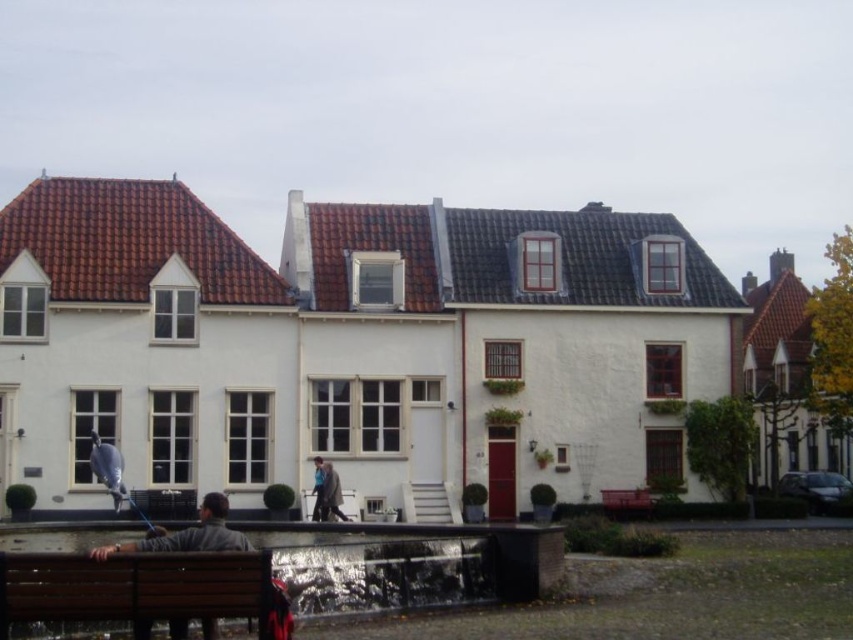
You are a tourist visiting this charming European street. You see a wooden bench at lower left and a blue denim jacket at center. Which object is positioned more to the left?

The wooden bench at lower left is positioned more to the left than the blue denim jacket at center.

You are a tourist standing in front of the row of traditional European houses. You see a brown wooden bench at lower left and a red wooden bench at lower right. Which bench is closer to the left side of the image?

The brown wooden bench at lower left is closer to the left side of the image because it is positioned to the left of the red wooden bench at lower right.